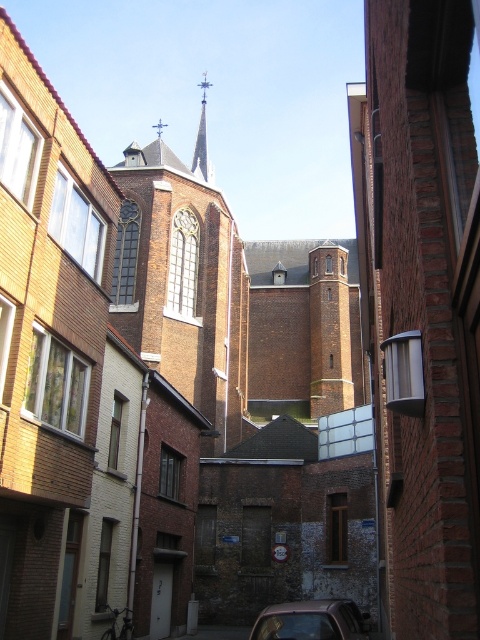
Consider the image. You are a delivery person needing to park your 2.5 meter wide truck in this alleyway. The truck must be parked between the metallic silver car at center and the smooth gray spire at center. Is there enough space for the truck to fit between them?

The metallic silver car at center is positioned under the smooth gray spire at center, meaning there is no space between them for the truck to park. The truck cannot fit between them.

You are a delivery driver trying to park your 1.8 meters wide truck in the alleyway. You see the metallic silver car at center and the smooth gray spire at center. Can your truck fit between them without touching either?

The metallic silver car at center has a lesser width compared to smooth gray spire at center. Since the truck is 1.8 meters wide and the car is narrower than the spire, there may be enough space between them. However, the exact width of the alleyway isn

You are a delivery drone trying to navigate through the narrow alleyway. There is a metallic silver car at center in your path. Based on its position, can you safely fly over it without hitting any obstacles?

The metallic silver car at center is located at coordinates point (310,620), which indicates its position is towards the lower right of the image. Since the alleyway is narrow and the car is parked at the bottom center right, there should be enough vertical clearance for the drone to fly over it safely as long as it maintains a steady altitude above the car.